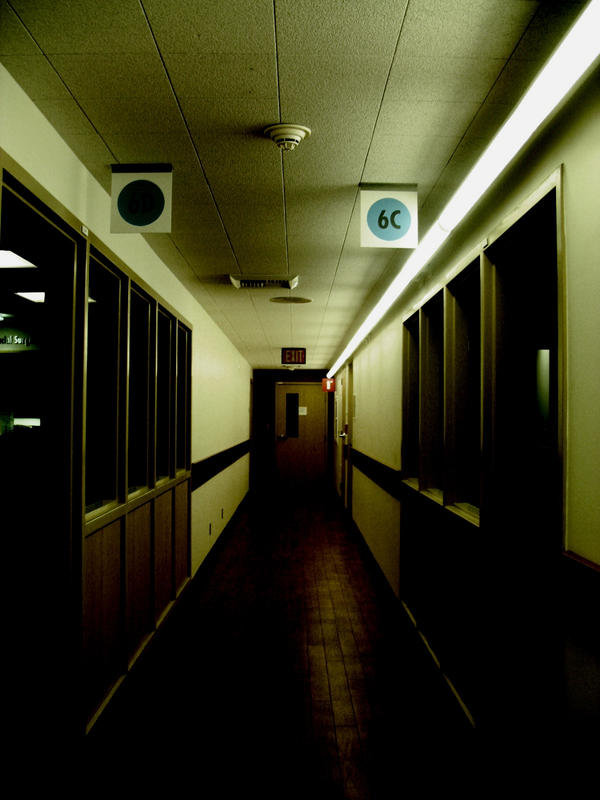
This screenshot has width=600, height=800. Find the location of `exit sign`. exit sign is located at coordinates (298, 357).